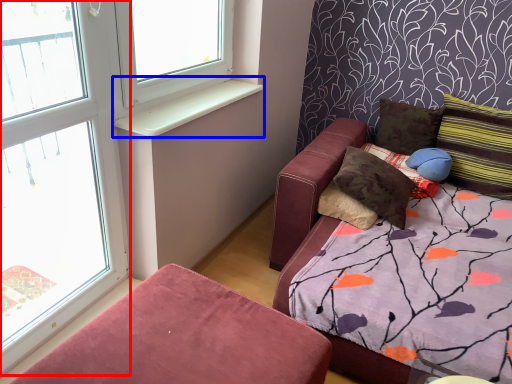
Question: Which object is further to the camera taking this photo, window frame (highlighted by a red box) or window sill (highlighted by a blue box)?

Choices:
 (A) window frame
 (B) window sill

Answer: (B)